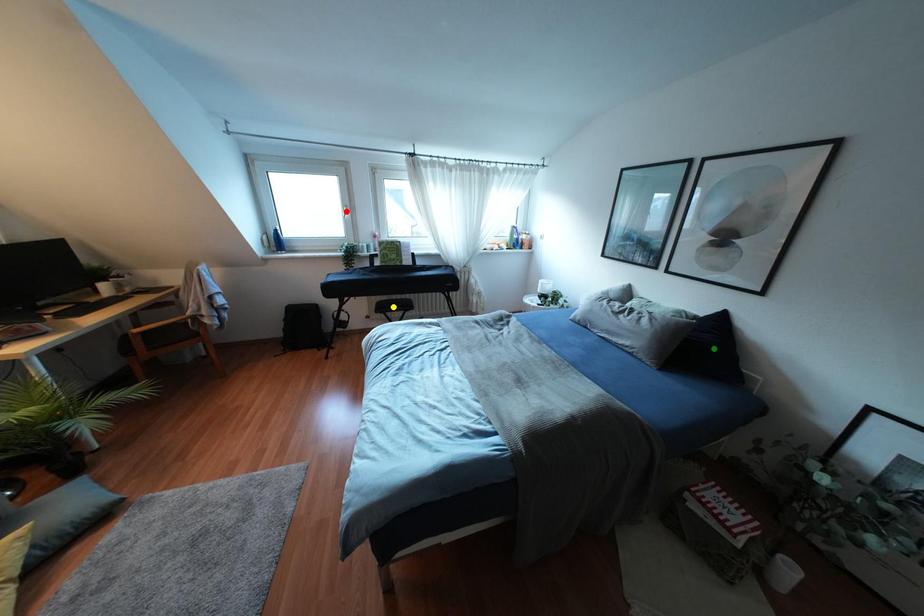
Order these from farthest to nearest:
1. yellow point
2. green point
3. red point

1. red point
2. yellow point
3. green point